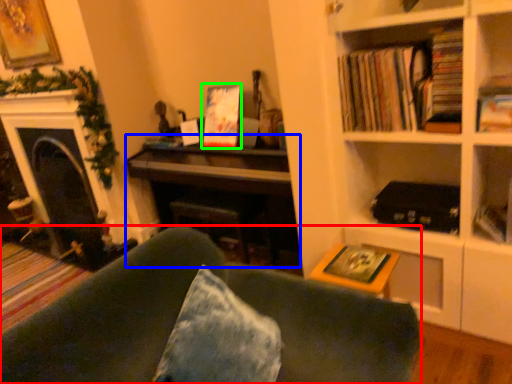
Question: Which is nearer to the studio couch (highlighted by a red box)? piano (highlighted by a blue box) or paperback book (highlighted by a green box).

Choices:
 (A) piano
 (B) paperback book

Answer: (A)